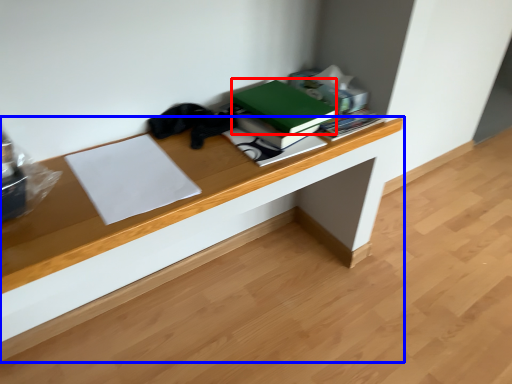
Question: Which object is closer to the camera taking this photo, paperback book (highlighted by a red box) or desk (highlighted by a blue box)?

Choices:
 (A) paperback book
 (B) desk

Answer: (A)